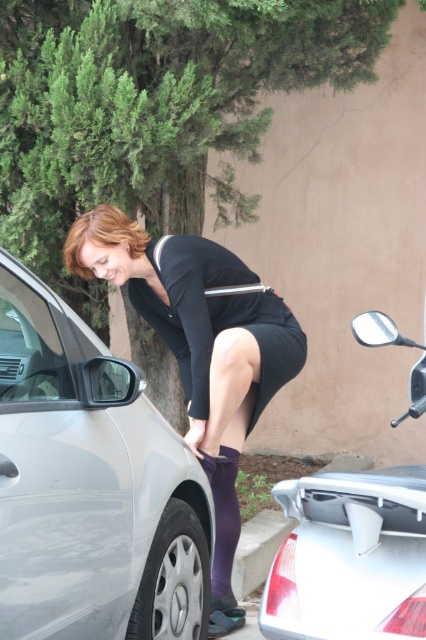
Question: Considering the real-world distances, which object is closest to the silver metallic car at lower right?

Choices:
 (A) satin silver car at left
 (B) matte black dress at center

Answer: (A)

Question: Does satin silver car at left have a smaller size compared to silver metallic car at lower right?

Choices:
 (A) yes
 (B) no

Answer: (B)

Question: Is satin silver car at left thinner than matte black dress at center?

Choices:
 (A) yes
 (B) no

Answer: (A)

Question: Is matte black dress at center closer to the viewer compared to silver metallic car at lower right?

Choices:
 (A) yes
 (B) no

Answer: (B)

Question: Which object is the farthest from the silver metallic car at lower right?

Choices:
 (A) matte black dress at center
 (B) satin silver car at left

Answer: (A)

Question: Which of these objects is positioned farthest from the silver metallic car at lower right?

Choices:
 (A) matte black dress at center
 (B) satin silver car at left

Answer: (A)